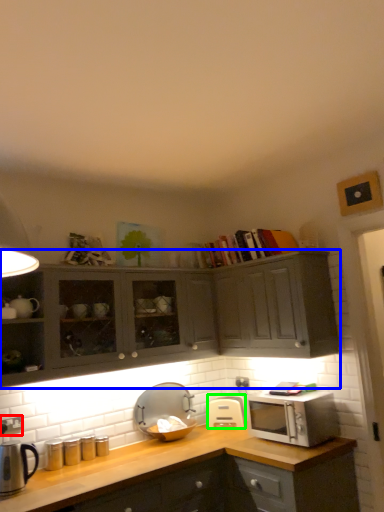
Question: Estimate the real-world distances between objects in this image. Which object is farther from electric outlet (highlighted by a red box), cabinetry (highlighted by a blue box) or appliance (highlighted by a green box)?

Choices:
 (A) cabinetry
 (B) appliance

Answer: (B)